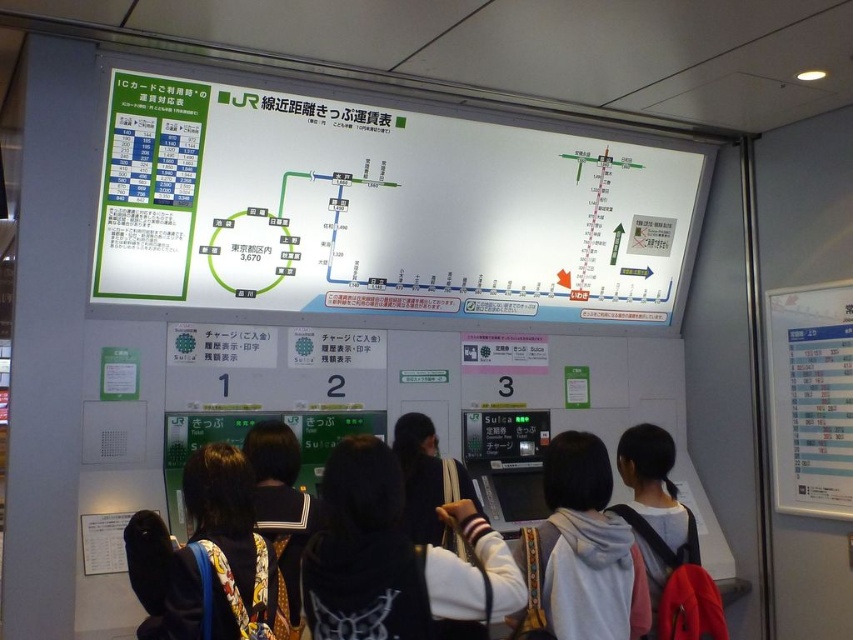
Based on the photo, you are a traveler at the train station and see two items in the ticketing area. The white matte hoodie at center and the printed fabric dress at center. Which one is positioned more to the right?

The white matte hoodie at center is positioned to the right of the printed fabric dress at center, so the white matte hoodie at center is more to the right.

You are a traveler carrying a 2 feet wide backpack and want to place it on the surface between the white paper at upper center and the white fabric at center. Will the backpack fit between them?

The distance between the white paper at upper center and the white fabric at center is 5.52 feet. Since the backpack is 2 feet wide, it will fit comfortably between them with 3.52 feet of space remaining.

You are a traveler at the train station and notice two items left on a bench near the ticketing area. The items are a white matte hoodie at center and a printed fabric dress at center. Which item is larger?

The printed fabric dress at center is larger than the white matte hoodie at center.